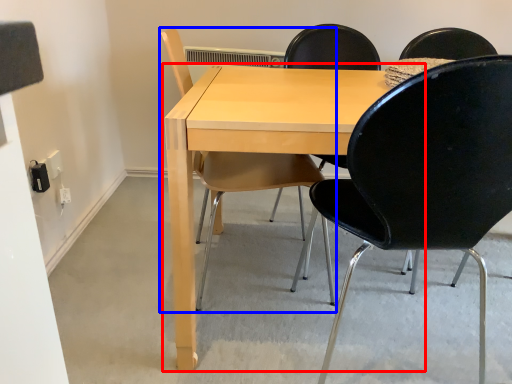
Question: Which object appears closest to the camera in this image, table (highlighted by a red box) or chair (highlighted by a blue box)?

Choices:
 (A) table
 (B) chair

Answer: (A)